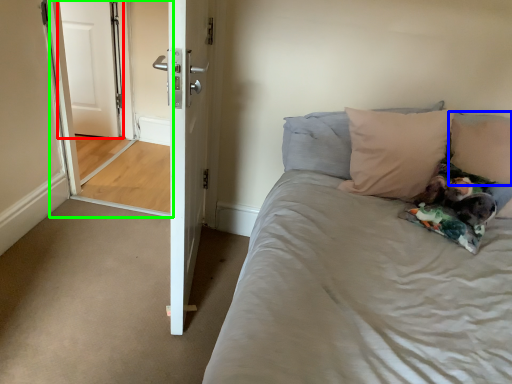
Question: Considering the real-world distances, which object is farthest from door (highlighted by a red box)? pillow (highlighted by a blue box) or screen door (highlighted by a green box)?

Choices:
 (A) pillow
 (B) screen door

Answer: (A)